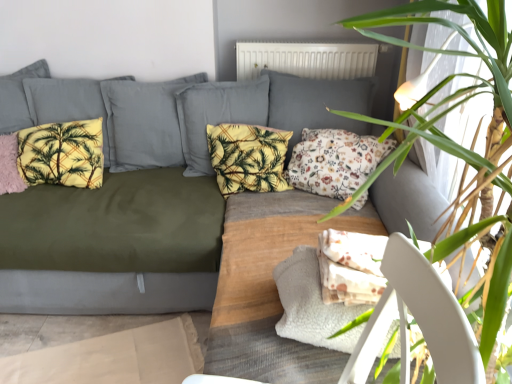
Question: Is pink fluffy pillow at left, placed as the 1th pillow when sorted from left to right, facing towards green leafy plant at upper right?

Choices:
 (A) yes
 (B) no

Answer: (B)

Question: Can you confirm if pink fluffy pillow at left, the fourth pillow positioned from the right, is shorter than green leafy plant at upper right?

Choices:
 (A) yes
 (B) no

Answer: (A)

Question: From a real-world perspective, is pink fluffy pillow at left, the fourth pillow positioned from the right, beneath green leafy plant at upper right?

Choices:
 (A) no
 (B) yes

Answer: (B)

Question: From the image's perspective, is pink fluffy pillow at left, placed as the 1th pillow when sorted from left to right, over green leafy plant at upper right?

Choices:
 (A) yes
 (B) no

Answer: (A)

Question: Does pink fluffy pillow at left, placed as the 1th pillow when sorted from left to right, have a lesser width compared to green leafy plant at upper right?

Choices:
 (A) no
 (B) yes

Answer: (B)

Question: Considering the relative positions of pink fluffy pillow at left, the fourth pillow positioned from the right, and green leafy plant at upper right in the image provided, is pink fluffy pillow at left, the fourth pillow positioned from the right, to the left of green leafy plant at upper right from the viewer's perspective?

Choices:
 (A) no
 (B) yes

Answer: (B)

Question: Does white matte radiator at upper center turn towards green leafy plant at upper right?

Choices:
 (A) no
 (B) yes

Answer: (B)

Question: Is white matte radiator at upper center closer to the viewer compared to green leafy plant at upper right?

Choices:
 (A) no
 (B) yes

Answer: (A)

Question: Is white matte radiator at upper center to the right of green leafy plant at upper right from the viewer's perspective?

Choices:
 (A) no
 (B) yes

Answer: (A)

Question: From a real-world perspective, is white matte radiator at upper center physically above green leafy plant at upper right?

Choices:
 (A) yes
 (B) no

Answer: (A)

Question: Is white matte radiator at upper center thinner than green leafy plant at upper right?

Choices:
 (A) yes
 (B) no

Answer: (A)

Question: Is white matte radiator at upper center positioned beyond the bounds of green leafy plant at upper right?

Choices:
 (A) no
 (B) yes

Answer: (B)

Question: Does pink fluffy pillow at left, placed as the 1th pillow when sorted from left to right, have a greater width compared to yellow fabric pillow at center, marked as the second pillow in a right-to-left arrangement?

Choices:
 (A) yes
 (B) no

Answer: (A)